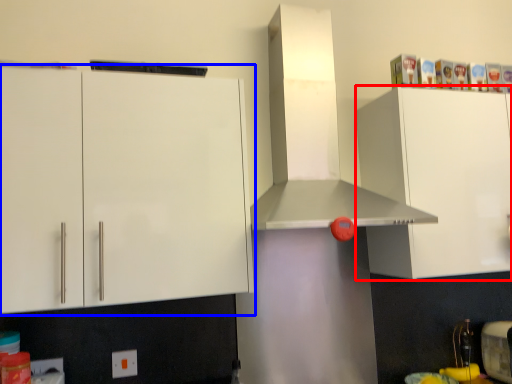
Question: Which of the following is the closest to the observer, cabinetry (highlighted by a red box) or cabinetry (highlighted by a blue box)?

Choices:
 (A) cabinetry
 (B) cabinetry

Answer: (B)